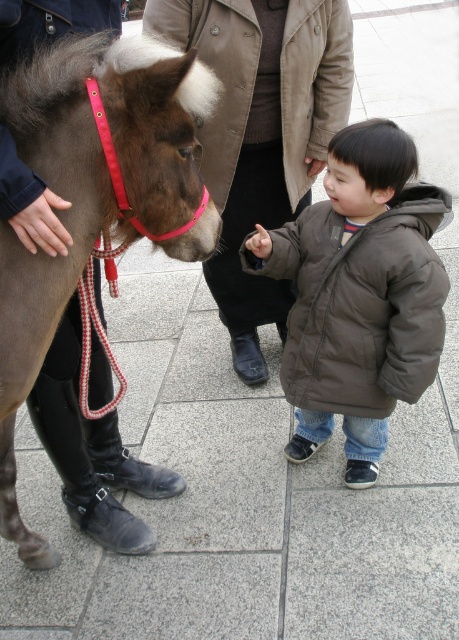
You are a photographer setting up a tripod to capture the scene with the brown leather mule at center and the brown puffy jacket at center. Which object should you focus on first if you want to ensure both are in frame but prioritize the smaller one?

The brown leather mule at center should be focused on first since it occupies less space than the brown puffy jacket at center, ensuring it is properly framed before adjusting for the larger object.

You are a photographer trying to capture a photo of the two jackets in the scene. The scene has a brown puffy jacket at center and a brown cotton jacket at center. Which jacket is positioned to the right side of the other?

The brown puffy jacket at center is to the right of the brown cotton jacket at center.

You are standing at the point labeled as point (x=365, y=384) and want to walk towards the pony. Which direction should you move to get closer to the pony without passing the point labeled as point (x=218, y=227)?

You should move forward towards the pony because point (x=218, y=227) is in front of point (x=365, y=384), meaning the pony is located in that direction.